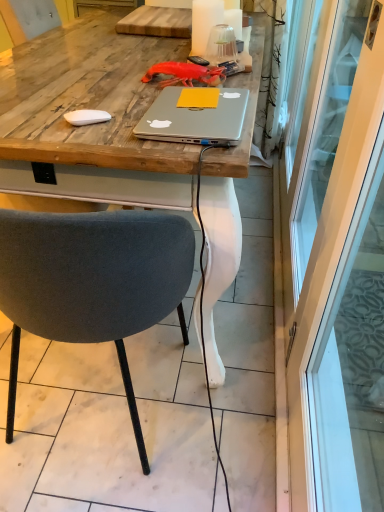
Locate an element on the screen. This screenshot has width=384, height=512. vacant region under velvet grey chair at center (from a real-world perspective) is located at coordinates (97, 392).